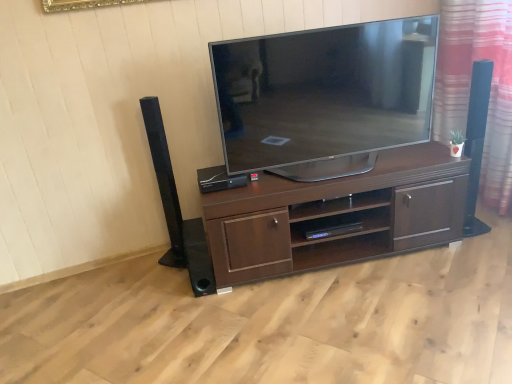
Question: From a real-world perspective, is black plastic speaker at center, arranged as the 1th speaker when viewed from the right, physically above velvet-like red curtain at right?

Choices:
 (A) yes
 (B) no

Answer: (A)

Question: From a real-world perspective, is black plastic speaker at center, arranged as the 1th speaker when viewed from the right, under velvet-like red curtain at right?

Choices:
 (A) yes
 (B) no

Answer: (B)

Question: Is velvet-like red curtain at right surrounded by black plastic speaker at center, arranged as the 1th speaker when viewed from the right?

Choices:
 (A) yes
 (B) no

Answer: (B)

Question: Considering the relative sizes of black plastic speaker at center, arranged as the 1th speaker when viewed from the right, and velvet-like red curtain at right in the image provided, is black plastic speaker at center, arranged as the 1th speaker when viewed from the right, smaller than velvet-like red curtain at right?

Choices:
 (A) no
 (B) yes

Answer: (B)

Question: Considering the relative sizes of black plastic speaker at center, which is the third speaker in left-to-right order, and velvet-like red curtain at right in the image provided, is black plastic speaker at center, which is the third speaker in left-to-right order, shorter than velvet-like red curtain at right?

Choices:
 (A) no
 (B) yes

Answer: (B)

Question: Considering the relative positions of black matte speaker at left, the 1th speaker from the left, and black plastic shelf at center in the image provided, is black matte speaker at left, the 1th speaker from the left, to the left or to the right of black plastic shelf at center?

Choices:
 (A) right
 (B) left

Answer: (B)

Question: From the image's perspective, is black matte speaker at left, the 1th speaker from the left, above or below black plastic shelf at center?

Choices:
 (A) above
 (B) below

Answer: (A)

Question: In terms of height, does black matte speaker at left, the 1th speaker from the left, look taller or shorter compared to black plastic shelf at center?

Choices:
 (A) short
 (B) tall

Answer: (B)

Question: Looking at the image, does black matte speaker at left, the 1th speaker from the left, seem bigger or smaller compared to black plastic shelf at center?

Choices:
 (A) small
 (B) big

Answer: (B)

Question: Does point (195, 251) appear closer or farther from the camera than point (202, 168)?

Choices:
 (A) closer
 (B) farther

Answer: (A)

Question: In the image, is black matte speaker at lower center, the 2th speaker from the right, on the left side or the right side of black plastic speaker at center, which is the third speaker in left-to-right order?

Choices:
 (A) left
 (B) right

Answer: (A)

Question: Do you think black matte speaker at lower center, the 2th speaker from the right, is within black plastic speaker at center, arranged as the 1th speaker when viewed from the right, or outside of it?

Choices:
 (A) inside
 (B) outside

Answer: (B)

Question: In terms of height, does black matte speaker at lower center, acting as the 2th speaker starting from the left, look taller or shorter compared to black plastic speaker at center, arranged as the 1th speaker when viewed from the right?

Choices:
 (A) tall
 (B) short

Answer: (A)

Question: Is black plastic speaker at center, arranged as the 1th speaker when viewed from the right, taller or shorter than black plastic shelf at center?

Choices:
 (A) short
 (B) tall

Answer: (B)

Question: Would you say black plastic speaker at center, arranged as the 1th speaker when viewed from the right, is to the left or to the right of black plastic shelf at center in the picture?

Choices:
 (A) right
 (B) left

Answer: (B)